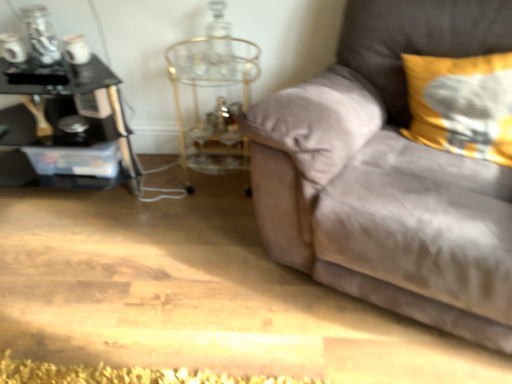
Describe the element at coordinates (218, 99) in the screenshot. I see `gold metallic side table at center` at that location.

Where is `suede couch at right`? This screenshot has height=384, width=512. suede couch at right is located at coordinates (387, 174).

Where is `black glass table at left`? Image resolution: width=512 pixels, height=384 pixels. black glass table at left is located at coordinates (62, 130).

Describe the element at coordinates (62, 130) in the screenshot. This screenshot has height=384, width=512. I see `black glass table at left` at that location.

The height and width of the screenshot is (384, 512). I want to click on yellow fabric pillow at upper right, so click(x=462, y=104).

In terms of width, does gold metallic side table at center look wider or thinner when compared to black glass table at left?

In the image, gold metallic side table at center appears to be more narrow than black glass table at left.

Between gold metallic side table at center and black glass table at left, which one appears on the left side from the viewer's perspective?

Positioned to the left is black glass table at left.

From the image's perspective, would you say gold metallic side table at center is positioned over black glass table at left?

Indeed, from the image's perspective, gold metallic side table at center is shown above black glass table at left.

Would you say gold metallic side table at center is outside black glass table at left?

Absolutely, gold metallic side table at center is external to black glass table at left.

From the picture: From the image's perspective, is suede couch at right located beneath gold metallic side table at center?

Yes.

Identify the location of side table below the suede couch at right (from a real-world perspective). (218, 99).

Is suede couch at right wider than gold metallic side table at center?

Yes.

Is point (486, 39) closer or farther from the camera than point (242, 138)?

Point (486, 39) appears to be closer to the viewer than point (242, 138).

Considering the relative sizes of yellow fabric pillow at upper right and black glass table at left in the image provided, is yellow fabric pillow at upper right shorter than black glass table at left?

Indeed, yellow fabric pillow at upper right has a lesser height compared to black glass table at left.

Between yellow fabric pillow at upper right and black glass table at left, which one has smaller width?

yellow fabric pillow at upper right is thinner.

You are a GUI agent. You are given a task and a screenshot of the screen. Output one action in this format:
    pyautogui.click(x=<x>, y=<y>)
    Task: Click on the table located behind the yellow fabric pillow at upper right
    The width and height of the screenshot is (512, 384).
    Given the screenshot: What is the action you would take?
    pyautogui.click(x=62, y=130)

Can you tell me how much yellow fabric pillow at upper right and black glass table at left differ in facing direction?

yellow fabric pillow at upper right and black glass table at left are facing 25.6 degrees away from each other.

Which object is further away from the camera, black glass table at left or suede couch at right?

black glass table at left is more distant.

Who is taller, black glass table at left or suede couch at right?

suede couch at right.

Considering the sizes of objects black glass table at left and suede couch at right in the image provided, who is thinner, black glass table at left or suede couch at right?

black glass table at left is thinner.

How far apart are black glass table at left and suede couch at right?

The distance of black glass table at left from suede couch at right is 1.10 meters.

You are a GUI agent. You are given a task and a screenshot of the screen. Output one action in this format:
    pyautogui.click(x=<x>, y=<y>)
    Task: Click on the table below the suede couch at right (from a real-world perspective)
    This screenshot has width=512, height=384.
    Given the screenshot: What is the action you would take?
    click(x=62, y=130)

Is suede couch at right positioned in front of black glass table at left?

Yes.

Could you tell me if suede couch at right is facing black glass table at left?

No, suede couch at right is not aimed at black glass table at left.

Is the surface of suede couch at right in direct contact with black glass table at left?

No, suede couch at right is not making contact with black glass table at left.

Based on their positions, is gold metallic side table at center located to the left or right of suede couch at right?

Based on their positions, gold metallic side table at center is located to the left of suede couch at right.

From a real-world perspective, is gold metallic side table at center under suede couch at right?

Correct, in the physical world, gold metallic side table at center is lower than suede couch at right.

Is point (231, 127) closer to camera compared to point (316, 224)?

That is False.

Which of these two, gold metallic side table at center or suede couch at right, is smaller?

gold metallic side table at center is smaller.

Who is bigger, yellow fabric pillow at upper right or suede couch at right?

suede couch at right.

Based on the photo, considering the positions of objects yellow fabric pillow at upper right and suede couch at right in the image provided, who is more to the right, yellow fabric pillow at upper right or suede couch at right?

Positioned to the right is yellow fabric pillow at upper right.

Could you tell me if yellow fabric pillow at upper right is facing suede couch at right?

Yes, yellow fabric pillow at upper right is facing suede couch at right.

You are a GUI agent. You are given a task and a screenshot of the screen. Output one action in this format:
    pyautogui.click(x=<x>, y=<y>)
    Task: Click on the side table behind the black glass table at left
    This screenshot has height=384, width=512.
    Given the screenshot: What is the action you would take?
    pyautogui.click(x=218, y=99)

Find the location of `studio couch that appears on the right of gold metallic side table at center`. studio couch that appears on the right of gold metallic side table at center is located at coordinates (387, 174).

When comparing their distances from suede couch at right, does yellow fabric pillow at upper right or gold metallic side table at center seem closer?

yellow fabric pillow at upper right lies closer to suede couch at right than the other object.

Considering their positions, is yellow fabric pillow at upper right positioned further to suede couch at right than black glass table at left?

The object further to suede couch at right is black glass table at left.

Looking at the image, which one is located closer to gold metallic side table at center, yellow fabric pillow at upper right or suede couch at right?

suede couch at right is closer to gold metallic side table at center.

Which object lies nearer to the anchor point gold metallic side table at center, suede couch at right or black glass table at left?

Based on the image, black glass table at left appears to be nearer to gold metallic side table at center.

Which object lies further to the anchor point black glass table at left, yellow fabric pillow at upper right or suede couch at right?

The object further to black glass table at left is yellow fabric pillow at upper right.

Based on their spatial positions, is gold metallic side table at center or yellow fabric pillow at upper right closer to suede couch at right?

yellow fabric pillow at upper right.

Which object lies nearer to the anchor point gold metallic side table at center, black glass table at left or yellow fabric pillow at upper right?

black glass table at left is positioned closer to the anchor gold metallic side table at center.

When comparing their distances from black glass table at left, does gold metallic side table at center or suede couch at right seem closer?

Among the two, gold metallic side table at center is located nearer to black glass table at left.

You are a GUI agent. You are given a task and a screenshot of the screen. Output one action in this format:
    pyautogui.click(x=<x>, y=<y>)
    Task: Click on the side table situated between black glass table at left and yellow fabric pillow at upper right from left to right
    The width and height of the screenshot is (512, 384).
    Given the screenshot: What is the action you would take?
    pyautogui.click(x=218, y=99)

Where is `studio couch between black glass table at left and yellow fabric pillow at upper right in the horizontal direction`? studio couch between black glass table at left and yellow fabric pillow at upper right in the horizontal direction is located at coordinates (387, 174).

Where is `side table between black glass table at left and suede couch at right`? side table between black glass table at left and suede couch at right is located at coordinates (218, 99).

Find the location of a particular element. The height and width of the screenshot is (384, 512). pillow between suede couch at right and gold metallic side table at center along the z-axis is located at coordinates click(462, 104).